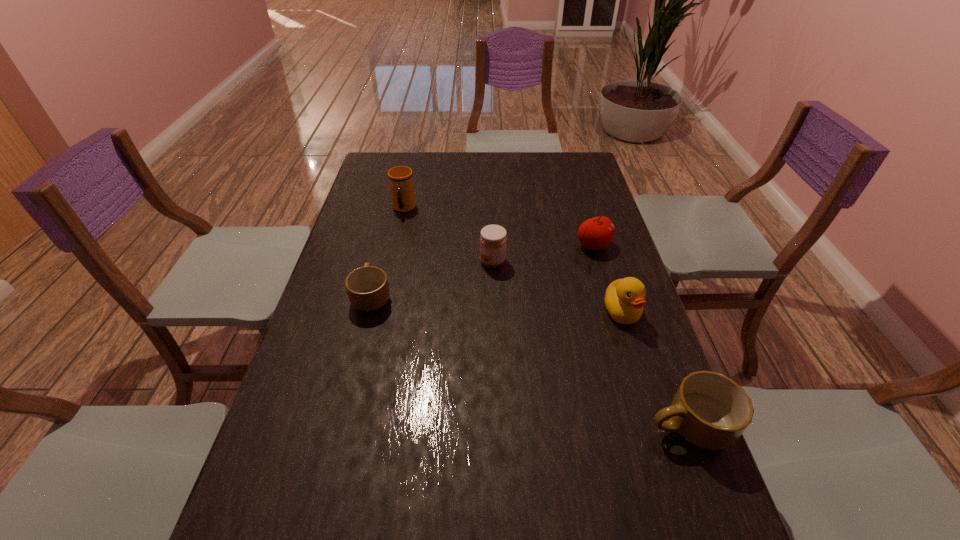
Find the location of a particular element. vacant area situated on the side with the handle of the shorter mug is located at coordinates (388, 234).

At what (x,y) coordinates should I click in order to perform the action: click on vacant space located 0.350m on the side with the handle of the right mug. Please return your answer as a coordinate pair (x, y). Looking at the image, I should click on (486, 426).

I want to click on free space located 0.310m on the side with the handle of the right mug, so click(504, 426).

This screenshot has width=960, height=540. Find the location of `free space located on the side with the handle of the right mug`. free space located on the side with the handle of the right mug is located at coordinates (600, 426).

This screenshot has width=960, height=540. Identify the location of vacant space located on the side of the farthest object with the handle. (386, 292).

You are a GUI agent. You are given a task and a screenshot of the screen. Output one action in this format:
    pyautogui.click(x=<x>, y=<y>)
    Task: Click on the vacant point located 0.380m on the back of the apple
    
    Given the screenshot: What is the action you would take?
    pyautogui.click(x=572, y=177)

The height and width of the screenshot is (540, 960). I want to click on free space located 0.210m at the beak of the duck, so click(x=650, y=402).

This screenshot has height=540, width=960. In order to click on vacant area located on the front label of the jam in this screenshot , I will do pos(393,262).

The image size is (960, 540). In order to click on vacant region located 0.240m on the front label of the jam in this screenshot , I will do `click(402, 262)`.

The width and height of the screenshot is (960, 540). I want to click on free spot located 0.140m on the front label of the jam, so click(x=434, y=262).